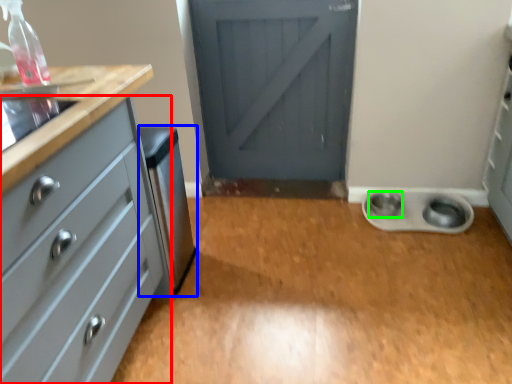
Question: Which object is the closest to the chest of drawers (highlighted by a red box)? Choose among these: appliance (highlighted by a blue box) or knob (highlighted by a green box).

Choices:
 (A) appliance
 (B) knob

Answer: (A)